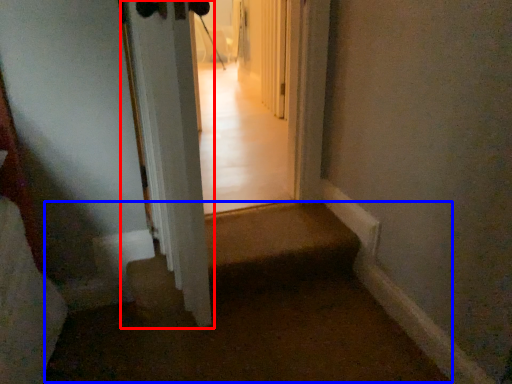
Question: Which of the following is the closest to the observer, door (highlighted by a red box) or corridor (highlighted by a blue box)?

Choices:
 (A) door
 (B) corridor

Answer: (A)